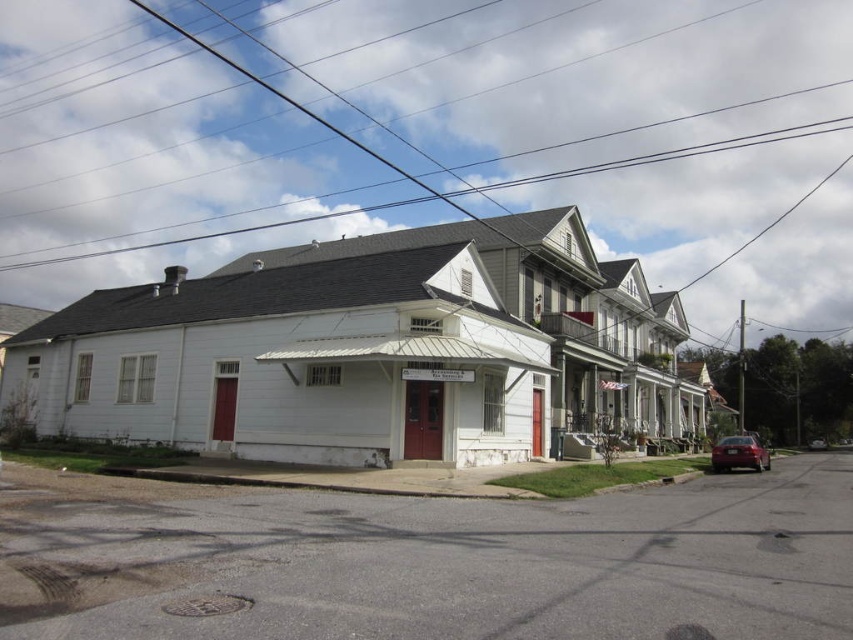
You are driving a car and want to park in the parking lot near the shiny red sedan at lower right and the metallic silver car at right. Which car should you avoid parking in front of to ensure both cars can exit easily?

You should avoid parking in front of the metallic silver car at right because the shiny red sedan at lower right is already in front of it, blocking its exit. The metallic silver car at right cannot move forward until the shiny red sedan at lower right moves first.

You are a delivery driver who needs to park your vehicle in this street scene. You have a shiny red sedan at lower right and a metallic silver car at right. Which car takes up more space on the road?

The shiny red sedan at lower right is bigger than the metallic silver car at right, so it takes up more space on the road.

You are standing at the point with coordinates (x=740, y=454) in the street scene. What object is located at that point?

The point at coordinates (x=740, y=454) indicates a shiny red sedan at lower right.